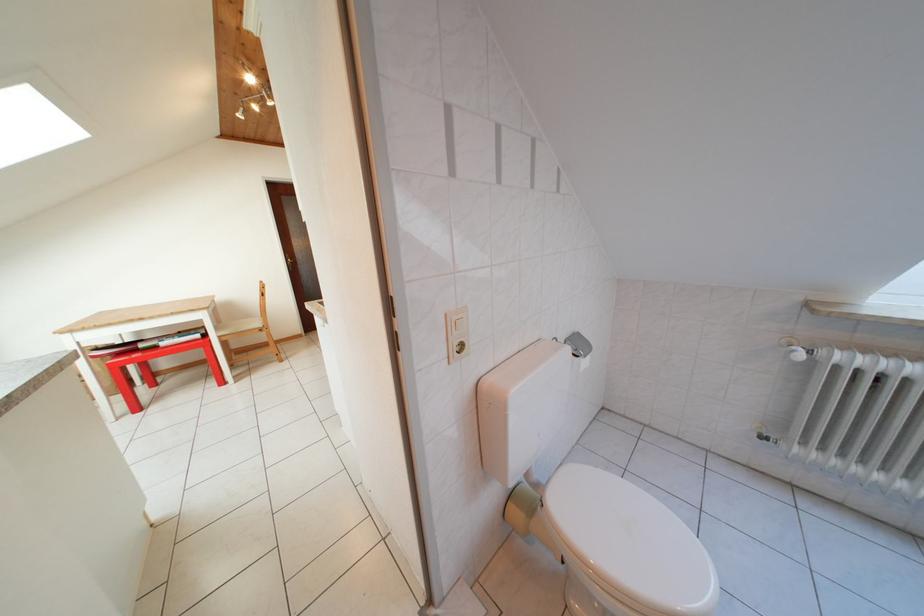
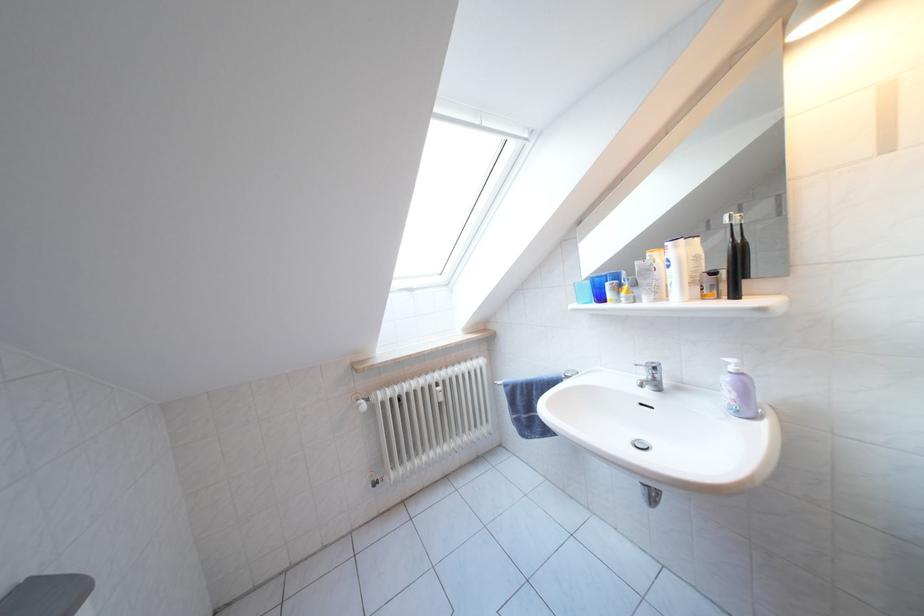
Question: How did the camera likely rotate?

Choices:
 (A) Left
 (B) Right
 (C) Up
 (D) Down

Answer: (B)